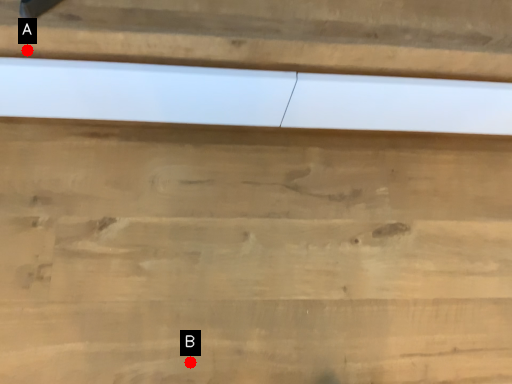
Question: Two points are circled on the image, labeled by A and B beside each circle. Which point appears farthest from the camera in this image?

Choices:
 (A) A is further
 (B) B is further

Answer: (B)